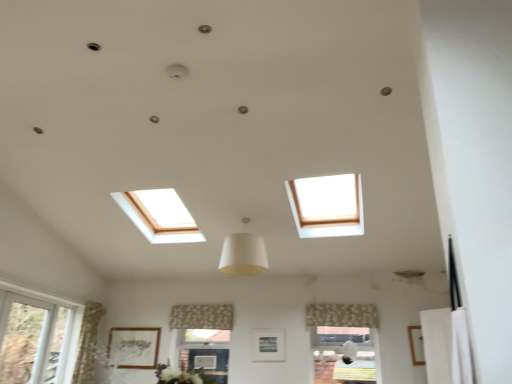
What do you see at coordinates (416, 345) in the screenshot? The image size is (512, 384). I see `wooden picture frame at lower right, which is the first picture frame from right to left` at bounding box center [416, 345].

In order to face white fabric lampshade at center, should I rotate leftwards or rightwards?

Rotate left and turn 1.482 degrees.

What do you see at coordinates (342, 315) in the screenshot?
I see `patterned fabric curtain at lower center, arranged as the second curtain when viewed from the back` at bounding box center [342, 315].

This screenshot has height=384, width=512. What do you see at coordinates (133, 347) in the screenshot? I see `matte white picture frame at lower center, which is the third picture frame from right to left` at bounding box center [133, 347].

Describe the element at coordinates (37, 336) in the screenshot. I see `white plastic window at lower left` at that location.

Identify the location of matte silver picture frame at center, which is the 2th picture frame in front-to-back order. This screenshot has height=384, width=512. (268, 345).

Does white plastic window at lower left turn towards matte silver picture frame at center, which is the 2th picture frame in front-to-back order?

Yes, white plastic window at lower left faces towards matte silver picture frame at center, which is the 2th picture frame in front-to-back order.

Is white plastic window at lower left further to the viewer compared to matte silver picture frame at center, arranged as the second picture frame when viewed from the left?

No, white plastic window at lower left is closer to the viewer.

Considering the sizes of white plastic window at lower left and matte silver picture frame at center, arranged as the second picture frame when viewed from the left, in the image, is white plastic window at lower left wider or thinner than matte silver picture frame at center, arranged as the second picture frame when viewed from the left,?

Considering their sizes, white plastic window at lower left looks broader than matte silver picture frame at center, arranged as the second picture frame when viewed from the left.

Does wooden picture frame at lower right, which is counted as the 3th picture frame, starting from the back, have a larger size compared to white fabric lampshade at center?

Incorrect, wooden picture frame at lower right, which is counted as the 3th picture frame, starting from the back, is not larger than white fabric lampshade at center.

From the image's perspective, is wooden picture frame at lower right, which is counted as the 3th picture frame, starting from the back, below white fabric lampshade at center?

Indeed, from the image's perspective, wooden picture frame at lower right, which is counted as the 3th picture frame, starting from the back, is shown beneath white fabric lampshade at center.

Locate an element on the screen. The width and height of the screenshot is (512, 384). the 1st picture frame positioned below the white fabric lampshade at center (from the image's perspective) is located at coordinates (416, 345).

From the picture: Can you tell me how much wooden picture frame at lower right, marked as the 3th picture frame in a left-to-right arrangement, and matte silver picture frame at center, the 2th picture frame when ordered from right to left, differ in facing direction?

0.00495 degrees separate the facing orientations of wooden picture frame at lower right, marked as the 3th picture frame in a left-to-right arrangement, and matte silver picture frame at center, the 2th picture frame when ordered from right to left.

Based on the photo, which object is wider, wooden picture frame at lower right, which is the first picture frame from right to left, or matte silver picture frame at center, the 2th picture frame when ordered from right to left?

With larger width is wooden picture frame at lower right, which is the first picture frame from right to left.

Are wooden picture frame at lower right, which is the first picture frame from right to left, and matte silver picture frame at center, which is the 2th picture frame in front-to-back order, located far from each other?

Yes, wooden picture frame at lower right, which is the first picture frame from right to left, and matte silver picture frame at center, which is the 2th picture frame in front-to-back order, are located far from each other.

Does wooden picture frame at lower right, which is the first picture frame from right to left, have a smaller size compared to matte silver picture frame at center, the 2th picture frame when ordered from right to left?

Indeed, wooden picture frame at lower right, which is the first picture frame from right to left, has a smaller size compared to matte silver picture frame at center, the 2th picture frame when ordered from right to left.

From the image's perspective, is matte white picture frame at lower center, the 1th picture frame viewed from the back, beneath white fabric lampshade at center?

Indeed, from the image's perspective, matte white picture frame at lower center, the 1th picture frame viewed from the back, is shown beneath white fabric lampshade at center.

Is matte white picture frame at lower center, the 1th picture frame viewed from the back, facing towards white fabric lampshade at center?

No.

This screenshot has width=512, height=384. What are the coordinates of `lamp on the right of matte white picture frame at lower center, the first picture frame in the left-to-right sequence` in the screenshot? It's located at (243, 255).

Considering the sizes of objects matte white picture frame at lower center, the first picture frame in the left-to-right sequence, and white fabric lampshade at center in the image provided, who is shorter, matte white picture frame at lower center, the first picture frame in the left-to-right sequence, or white fabric lampshade at center?

matte white picture frame at lower center, the first picture frame in the left-to-right sequence.

Between matte silver picture frame at center, positioned as the 2th picture frame in back-to-front order, and white fabric lampshade at center, which one has larger width?

white fabric lampshade at center.

Is point (282, 350) less distant than point (263, 268)?

That is False.

Is the position of matte silver picture frame at center, which is the 2th picture frame in front-to-back order, less distant than that of white fabric lampshade at center?

No, it is behind white fabric lampshade at center.

Is white plastic window at lower left wider than patterned fabric curtain at lower center, positioned as the 2th curtain in left-to-right order?

No, white plastic window at lower left is not wider than patterned fabric curtain at lower center, positioned as the 2th curtain in left-to-right order.

Who is more distant, white plastic window at lower left or patterned fabric curtain at lower center, which appears as the 1th curtain when viewed from the right?

patterned fabric curtain at lower center, which appears as the 1th curtain when viewed from the right.

Which of these two, white plastic window at lower left or patterned fabric curtain at lower center, arranged as the second curtain when viewed from the back, stands shorter?

Standing shorter between the two is patterned fabric curtain at lower center, arranged as the second curtain when viewed from the back.

From the image's perspective, which is below, white plastic window at lower left or patterned fabric curtain at lower center, which appears as the 1th curtain when viewed from the right?

From the image's view, white plastic window at lower left is below.

Which object is more forward, matte silver picture frame at center, which is the 2th picture frame in front-to-back order, or matte white picture frame at lower center, which appears as the third picture frame when viewed from the front?

matte silver picture frame at center, which is the 2th picture frame in front-to-back order, is more forward.

Does point (270, 340) come farther from viewer compared to point (121, 360)?

No, (270, 340) is closer to viewer.

You are a GUI agent. You are given a task and a screenshot of the screen. Output one action in this format:
    pyautogui.click(x=<x>, y=<y>)
    Task: Click on the picture frame that is the 1st one when counting upward from the matte white picture frame at lower center, the 1th picture frame viewed from the back (from the image's perspective)
    
    Given the screenshot: What is the action you would take?
    pyautogui.click(x=268, y=345)

Does matte silver picture frame at center, which is the 2th picture frame in front-to-back order, turn towards matte white picture frame at lower center, the 1th picture frame viewed from the back?

No, matte silver picture frame at center, which is the 2th picture frame in front-to-back order, does not turn towards matte white picture frame at lower center, the 1th picture frame viewed from the back.

In the image, there is a matte silver picture frame at center, positioned as the 2th picture frame in back-to-front order. Where is `window above it (from the image's perspective)`? The height and width of the screenshot is (384, 512). window above it (from the image's perspective) is located at coordinates (37, 336).

Image resolution: width=512 pixels, height=384 pixels. In order to click on picture frame that is the 1st object located behind the white fabric lampshade at center in this screenshot , I will do `click(416, 345)`.

Estimate the real-world distances between objects in this image. Which object is closer to wooden picture frame at lower right, the first picture frame viewed from the front, matte silver picture frame at center, which is the 2th picture frame in front-to-back order, or patterned fabric curtain at lower center, positioned as the 2th curtain in left-to-right order?

patterned fabric curtain at lower center, positioned as the 2th curtain in left-to-right order.

Considering their positions, is matte white picture frame at lower center, the first picture frame in the left-to-right sequence, positioned closer to white plastic window at lower left than white fabric lampshade at center?

Among the two, matte white picture frame at lower center, the first picture frame in the left-to-right sequence, is located nearer to white plastic window at lower left.

Based on their spatial positions, is white fabric lampshade at center or patterned fabric curtain at lower center, which appears as the 1th curtain when viewed from the right, closer to matte white picture frame at lower center, which is the third picture frame from right to left?

patterned fabric curtain at lower center, which appears as the 1th curtain when viewed from the right.

Considering their positions, is matte silver picture frame at center, arranged as the second picture frame when viewed from the left, positioned closer to white plastic window at lower left than white fabric lampshade at center?

white fabric lampshade at center lies closer to white plastic window at lower left than the other object.

When comparing their distances from matte silver picture frame at center, arranged as the second picture frame when viewed from the left, does white plastic window at lower left or matte white picture frame at lower center, which appears as the third picture frame when viewed from the front, seem closer?

matte white picture frame at lower center, which appears as the third picture frame when viewed from the front, is closer to matte silver picture frame at center, arranged as the second picture frame when viewed from the left.

Looking at the image, which one is located further to floral fabric curtain at center, arranged as the 2th curtain when viewed from the front, wooden picture frame at lower right, the first picture frame viewed from the front, or matte white picture frame at lower center, the first picture frame in the left-to-right sequence?

wooden picture frame at lower right, the first picture frame viewed from the front, is further to floral fabric curtain at center, arranged as the 2th curtain when viewed from the front.

Which object lies further to the anchor point wooden picture frame at lower right, which is counted as the 3th picture frame, starting from the back, white plastic window at lower left or floral fabric curtain at center, arranged as the 2th curtain when viewed from the front?

Based on the image, white plastic window at lower left appears to be further to wooden picture frame at lower right, which is counted as the 3th picture frame, starting from the back.

Which object lies nearer to the anchor point floral fabric curtain at center, which is counted as the 1th curtain, starting from the left, matte silver picture frame at center, positioned as the 2th picture frame in back-to-front order, or patterned fabric curtain at lower center, which appears as the 1th curtain when viewed from the right?

matte silver picture frame at center, positioned as the 2th picture frame in back-to-front order, lies closer to floral fabric curtain at center, which is counted as the 1th curtain, starting from the left, than the other object.

Find the location of `lamp located between white plastic window at lower left and patterned fabric curtain at lower center, positioned as the 2th curtain in left-to-right order, in the left-right direction`. lamp located between white plastic window at lower left and patterned fabric curtain at lower center, positioned as the 2th curtain in left-to-right order, in the left-right direction is located at coordinates (243, 255).

The height and width of the screenshot is (384, 512). Find the location of `picture frame between matte white picture frame at lower center, the first picture frame in the left-to-right sequence, and wooden picture frame at lower right, which is counted as the 3th picture frame, starting from the back`. picture frame between matte white picture frame at lower center, the first picture frame in the left-to-right sequence, and wooden picture frame at lower right, which is counted as the 3th picture frame, starting from the back is located at coordinates (268, 345).

Find the location of a particular element. The width and height of the screenshot is (512, 384). lamp between white plastic window at lower left and wooden picture frame at lower right, which is the first picture frame from right to left, in the horizontal direction is located at coordinates (243, 255).

Image resolution: width=512 pixels, height=384 pixels. Identify the location of lamp located between floral fabric curtain at center, acting as the 2th curtain starting from the right, and patterned fabric curtain at lower center, the first curtain when ordered from front to back, in the left-right direction. (243, 255).